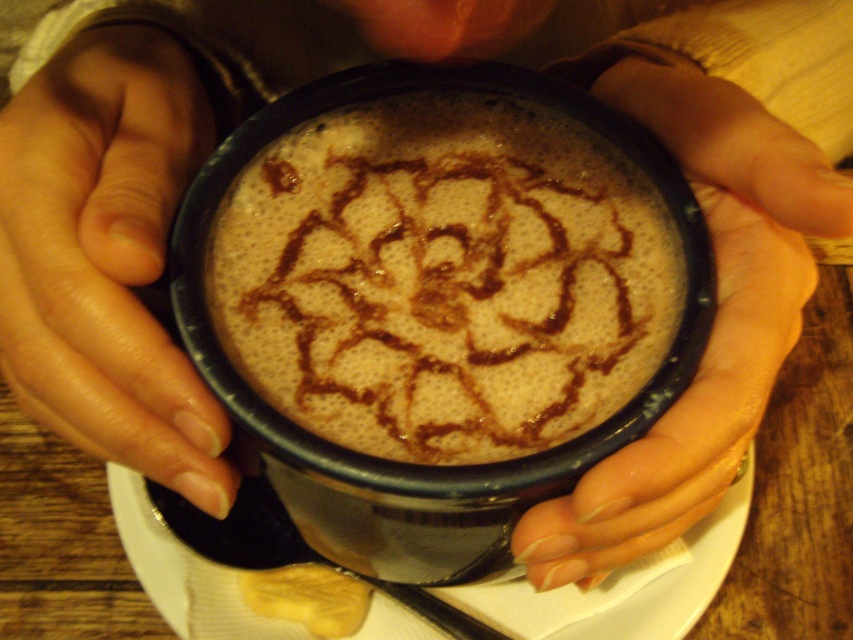
You are a photographer trying to capture the intricate latte art on the mug. The latte art is located at point [100,253]. To ensure the art is in focus, you need to adjust your camera so that the focal point is exactly at the latte art. The camera has a depth of field that can cover objects within a 10 inch range. Is the latte art within the camera focus range?

Point [100,253] is 10.49 inches away from camera. Since the depth of field covers up to 10 inches, the latte art is slightly out of focus range. Adjust the focus to be closer to 10.49 inches.

You are a photographer trying to capture the latte art on the mug. To ensure the nails don not block the view of the latte art, should you move the camera to the left or right of the nail polish coated nails at lower left?

The nail polish coated nails at lower left are positioned at point (106, 256). To avoid blocking the latte art, move the camera to the right side of the nail polish coated nails at lower left.

You are a barista preparing a latte and notice the customer has the nail polish coated fingers at center and the white paper napkin at center. Which object is bigger?

The nail polish coated fingers at center has a larger size compared to the white paper napkin at center.